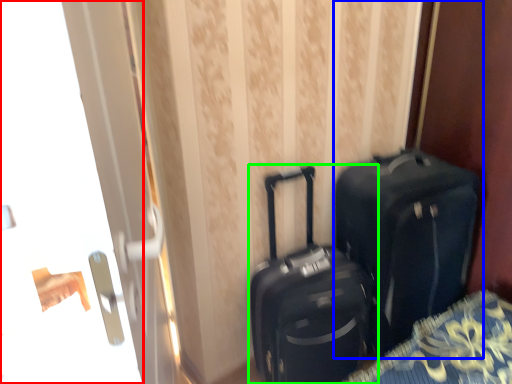
Question: Which object is the farthest from screen door (highlighted by a red box)? Choose among these: luggage and bags (highlighted by a blue box) or suitcase (highlighted by a green box).

Choices:
 (A) luggage and bags
 (B) suitcase

Answer: (A)